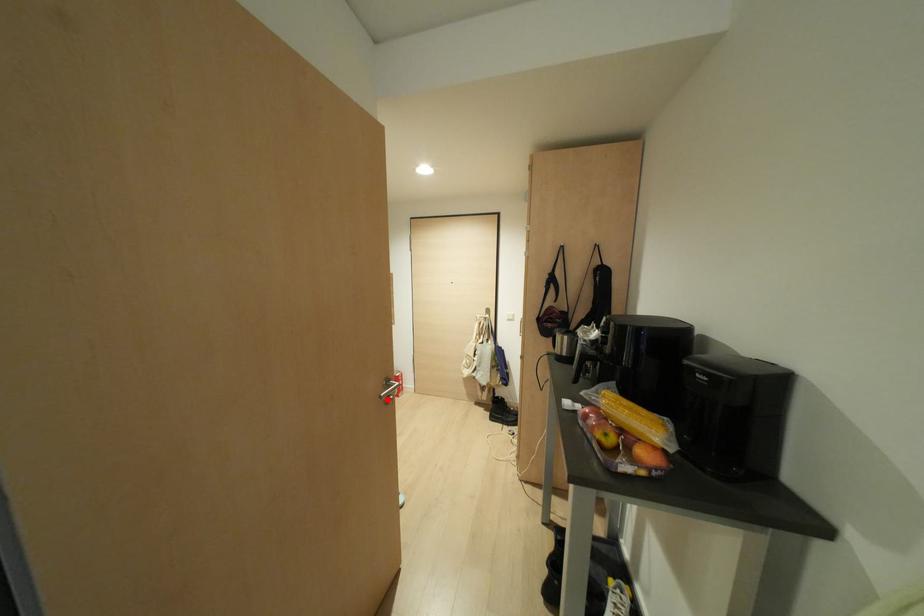
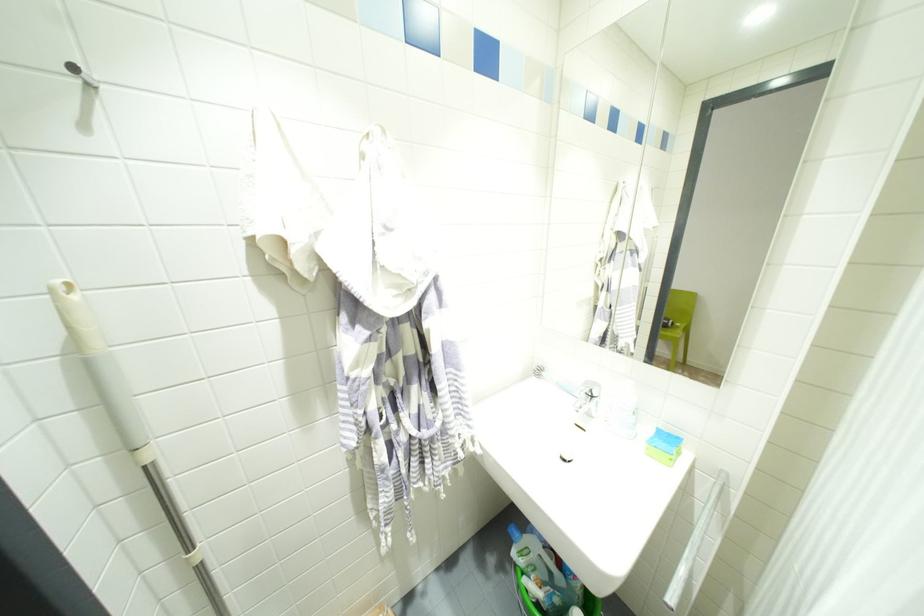
Question: I am providing you with two images of the same scene from different viewpoints. A red point is marked on the first image. Is the red point's position out of view in image 2?

Choices:
 (A) Yes
 (B) No

Answer: (A)